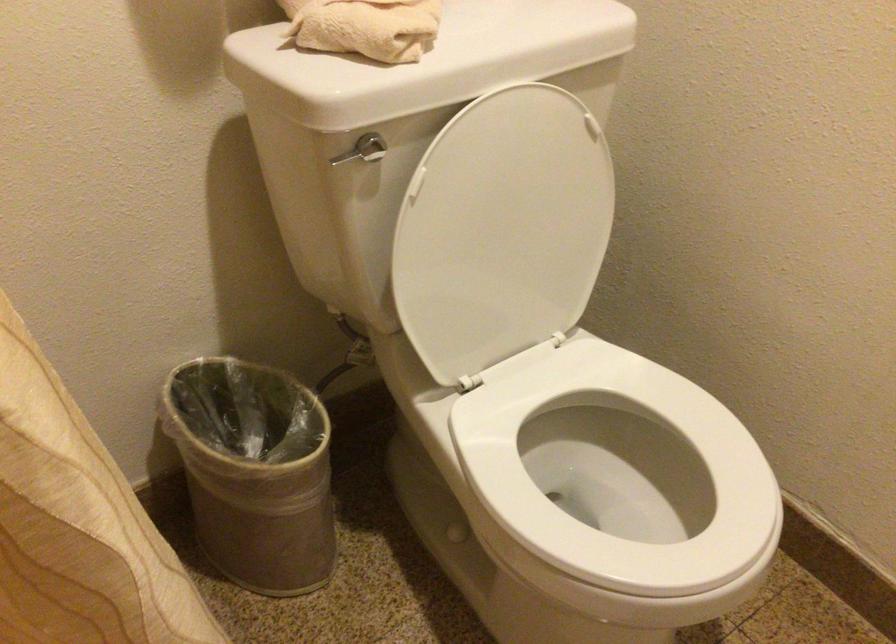
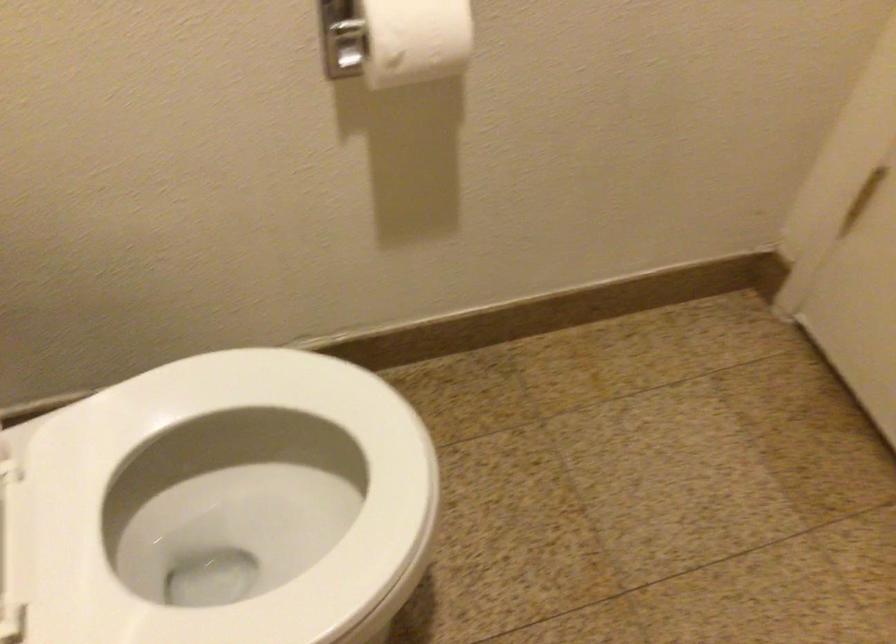
The images are taken continuously from a first-person perspective. In which direction is your viewpoint rotating?

The camera rotated toward right-down.